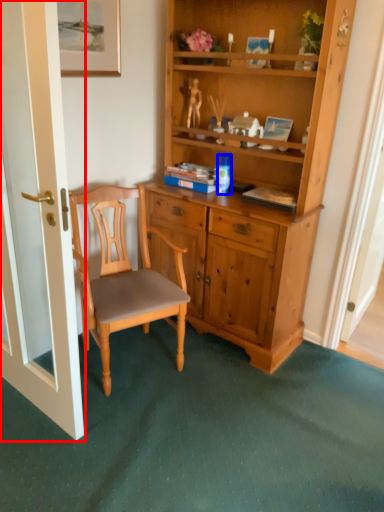
Question: Among these objects, which one is nearest to the camera, door (highlighted by a red box) or coffee cup (highlighted by a blue box)?

Choices:
 (A) door
 (B) coffee cup

Answer: (A)